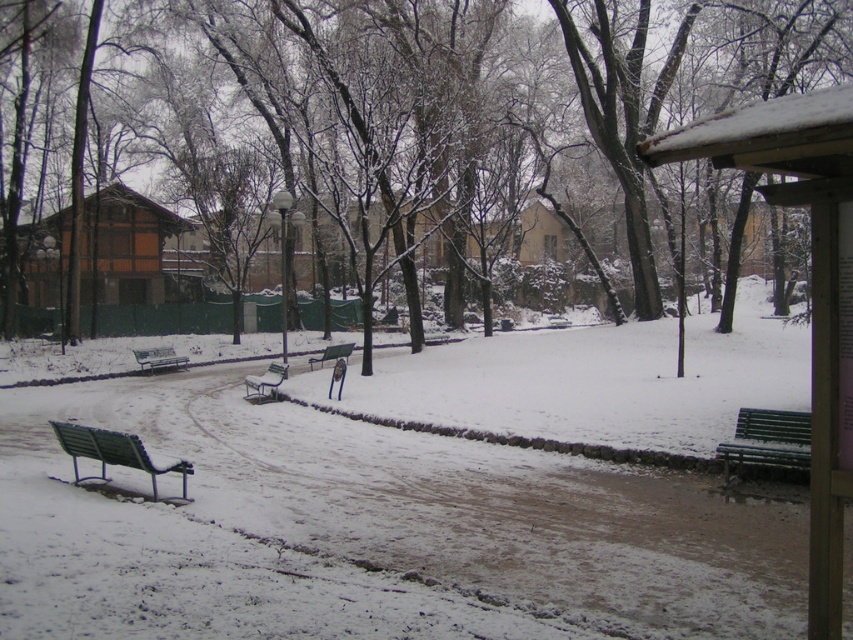
Question: Is white matte snow at center wider than metallic green bench at lower left?

Choices:
 (A) no
 (B) yes

Answer: (B)

Question: Among these points, which one is farthest from the camera?

Choices:
 (A) (265, 388)
 (B) (785, 451)

Answer: (A)

Question: Which object is positioned closest to the white matte snow at center?

Choices:
 (A) snow-covered tree at center
 (B) metallic green bench at lower left
 (C) metallic green bench at center
 (D) metallic silver bench at center

Answer: (C)

Question: Is metallic green bench at lower left to the right of green wooden bench at center from the viewer's perspective?

Choices:
 (A) yes
 (B) no

Answer: (A)

Question: Which object is positioned closest to the green wooden bench at center?

Choices:
 (A) white matte snow at center
 (B) metallic green bench at lower left
 (C) wooden bench at right
 (D) green painted wood bench at lower right

Answer: (A)

Question: Can you confirm if white matte snow at center is thinner than metallic green bench at lower left?

Choices:
 (A) no
 (B) yes

Answer: (A)